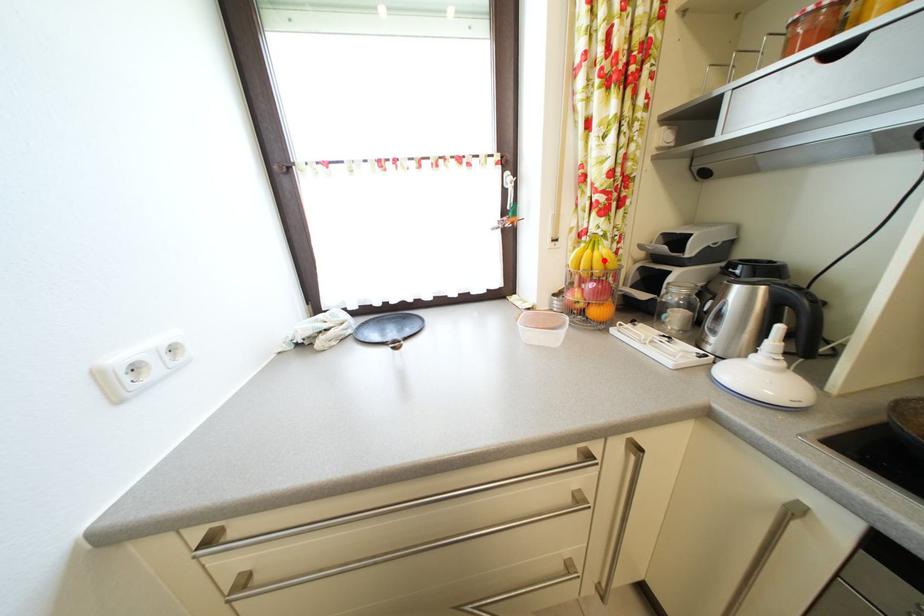
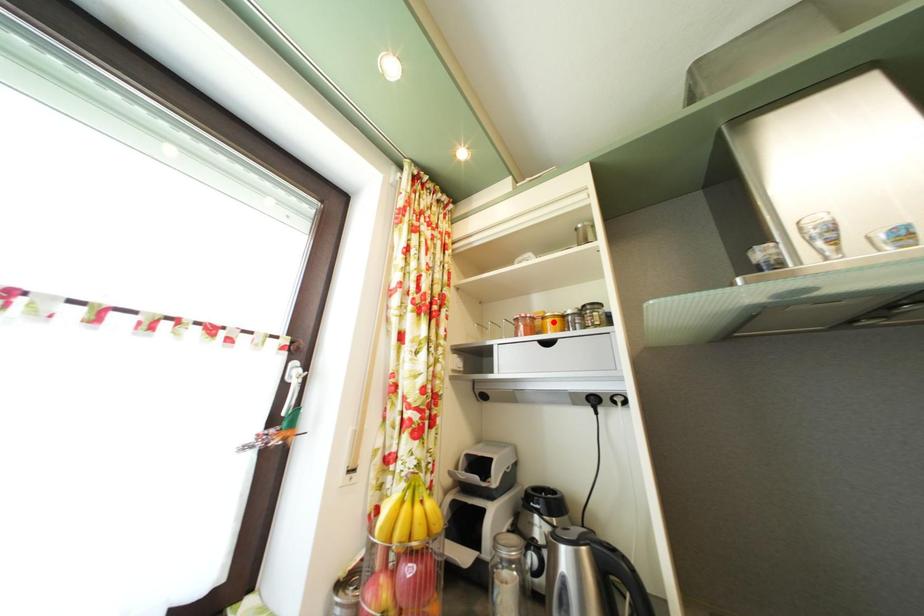
I am providing you with two images of the same scene from different viewpoints. A red point is marked on the first image and another point is marked on the second image. Are the points marked in image1 and image2 representing the same 3D position?

No